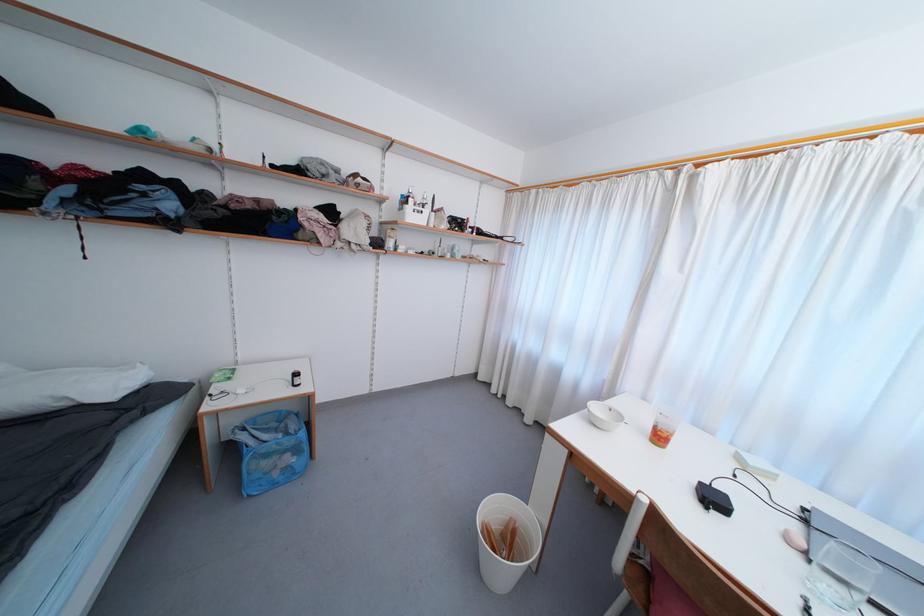
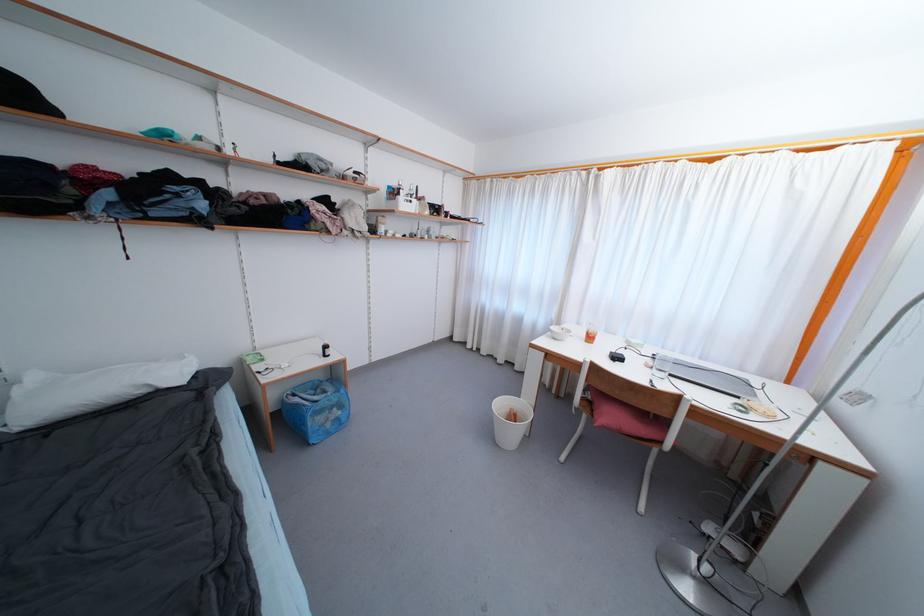
The point at (718, 503) is marked in the first image. Where is the corresponding point in the second image?

(621, 361)